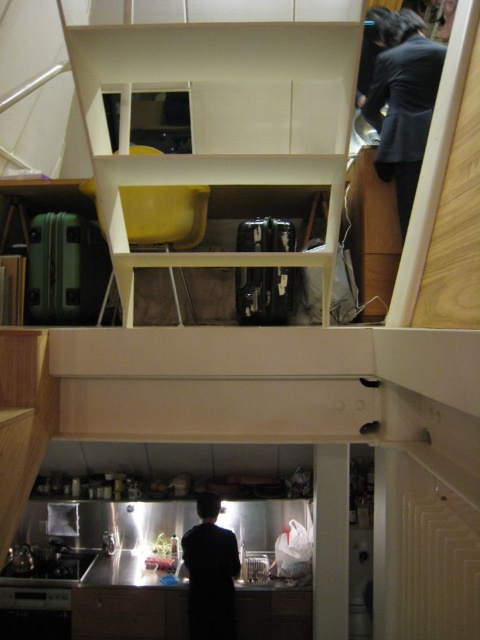
Can you confirm if dark blue suit at upper right is bigger than matte wood drawer at lower center?

Indeed, dark blue suit at upper right has a larger size compared to matte wood drawer at lower center.

Which is behind, point (397, 29) or point (74, 625)?

The point (74, 625) is more distant.

Image resolution: width=480 pixels, height=640 pixels. What do you see at coordinates (403, 102) in the screenshot?
I see `dark blue suit at upper right` at bounding box center [403, 102].

Locate an element on the screen. This screenshot has width=480, height=640. dark blue suit at upper right is located at coordinates (403, 102).

Does point (381, 122) come closer to viewer compared to point (220, 568)?

That is True.

Between point (420, 80) and point (223, 580), which one is positioned behind?

Positioned behind is point (223, 580).

Who is more distant from viewer, (415,48) or (182,536)?

Positioned behind is point (182,536).

I want to click on dark blue suit at upper right, so click(x=403, y=102).

Can you confirm if dark matte shirt at lower center is smaller than matte wood drawer at lower center?

No.

How distant is dark matte shirt at lower center from matte wood drawer at lower center?

dark matte shirt at lower center is 42.75 centimeters from matte wood drawer at lower center.

Who is more distant from viewer, [203,609] or [142,609]?

The point [142,609] is behind.

Locate an element on the screen. The width and height of the screenshot is (480, 640). dark matte shirt at lower center is located at coordinates (211, 572).